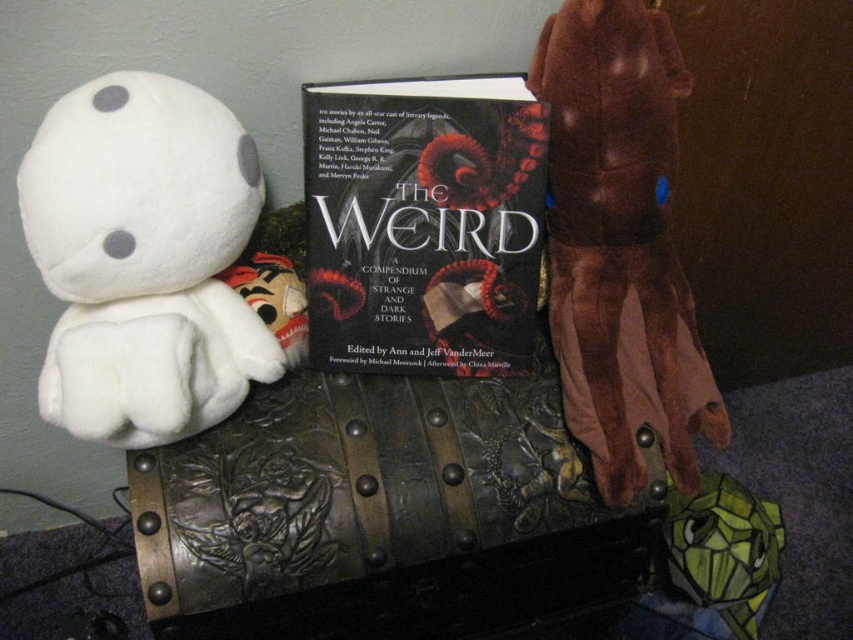
You are organizing items on a table and see the white plush toy at left and the dark matte book at center. Which item is positioned closer to the edge of the table?

The white plush toy at left is closer to the viewer than the dark matte book at center, so it is positioned closer to the edge of the table.

Please describe the position of the white plush toy at left relative to the book titled

The white plush toy at left is positioned to the left of the book titled